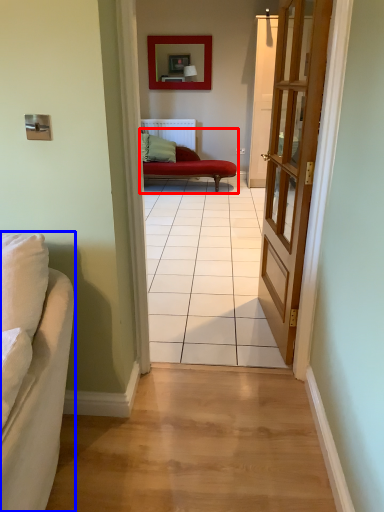
Question: Which object is further to the camera taking this photo, studio couch (highlighted by a red box) or studio couch (highlighted by a blue box)?

Choices:
 (A) studio couch
 (B) studio couch

Answer: (A)